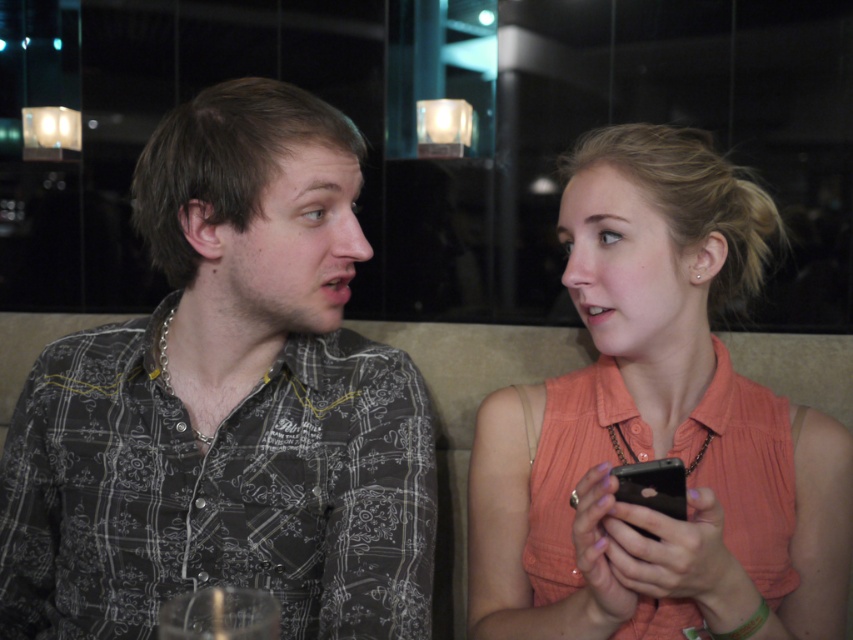
You are an AI analyzing the spatial coordinates of clothing items in the image. The dark gray printed shirt at left is located at which coordinate point?

The dark gray printed shirt at left is located at coordinate point (227, 404).

You are a photographer trying to capture a candid shot of both the dark gray printed shirt at left and the black matte smartphone at lower right. Since you want to ensure both are in focus, which object should you prioritize focusing on first?

You should focus on the dark gray printed shirt at left first because it is closer to the viewer than the black matte smartphone at lower right, so adjusting focus from near to far will help both be in focus.